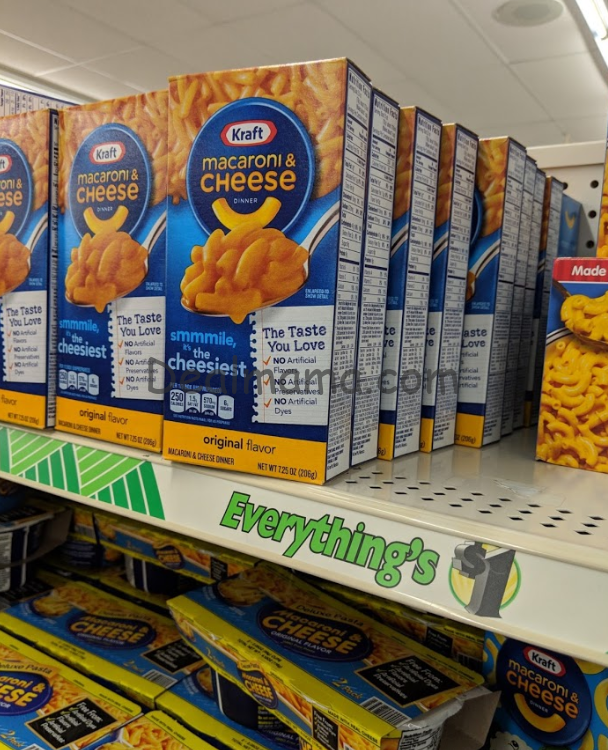
Find the location of a particular element. This screenshot has height=750, width=608. lime green design on shelf is located at coordinates (9, 429), (15, 434), (22, 440), (26, 448), (30, 457), (78, 445), (81, 450), (86, 459), (95, 472), (101, 478).